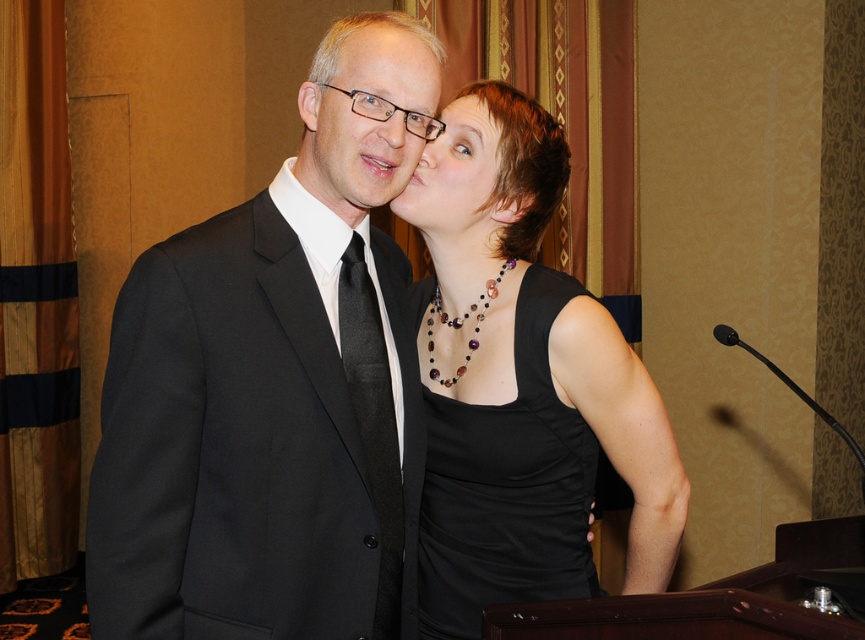
You are a photographer standing at the camera position. You want to take a photo of the man in the black suit and the woman in the black dress. The focus point of your camera is set to point (325,100). Is this point within the recommended focus range of 4 feet to 5 feet from the camera?

The point (325,100) is 4.22 feet away from the camera, which falls within the recommended focus range of 4 feet to 5 feet. Therefore, the focus point is suitable for capturing both subjects clearly.

You are organizing a charity event and need to arrange seating for two guests wearing the black matte suit at center and the black matte tank top at center. If the table has limited space, which guest might require more space due to their attire?

The black matte suit at center might be wider than black matte tank top at center, so the guest wearing the black matte suit at center might require more space.

You are a photographer at a formal event. You notice two black dresses in the image. The first is labeled as the black matte dress at center, and the second is the matte black dress at center. According to the scene description, which dress is positioned to the right?

The black matte dress at center is positioned on the right side of the matte black dress at center.